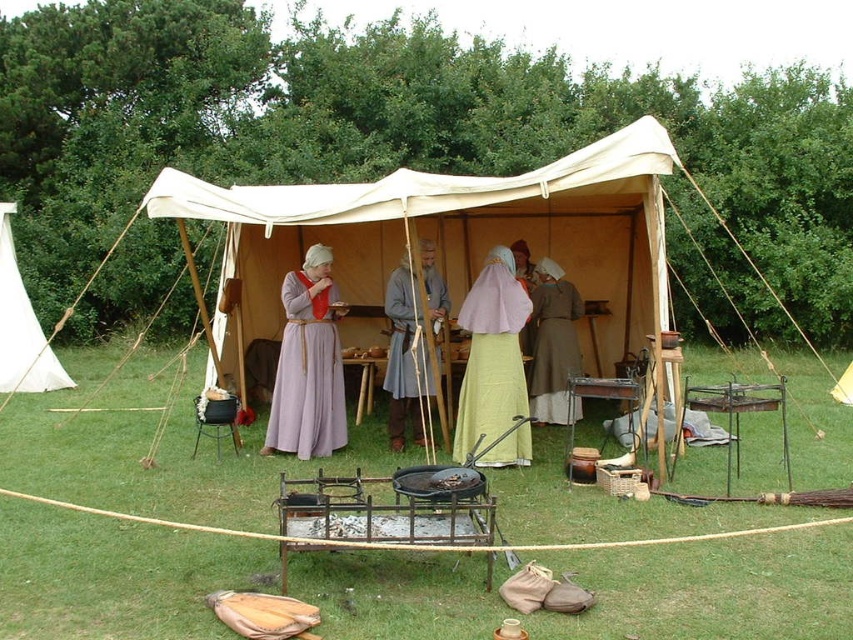
Question: Observing the image, what is the correct spatial positioning of brown woolen robe at center in reference to white canvas canopy at left?

Choices:
 (A) left
 (B) right

Answer: (B)

Question: Does lavender fabric dress at center lie behind gray woolen tunic at center?

Choices:
 (A) yes
 (B) no

Answer: (A)

Question: Which point is closer to the camera?

Choices:
 (A) (296, 419)
 (B) (549, 289)
 (C) (418, 362)

Answer: (A)

Question: Which point is farther from the camera taking this photo?

Choices:
 (A) (0, 387)
 (B) (283, 436)

Answer: (A)

Question: Does gray woolen tunic at center have a lesser width compared to white canvas canopy at left?

Choices:
 (A) no
 (B) yes

Answer: (B)

Question: Which point is closer to the camera?

Choices:
 (A) white canvas canopy at left
 (B) light yellow fabric dress at center
 (C) brown woolen robe at center
 (D) gray woolen tunic at center

Answer: (D)